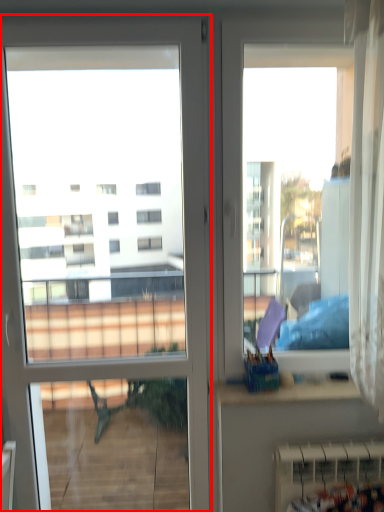
Question: From the image's perspective, what is the correct spatial positioning of door (annotated by the red box) in reference to radiator?

Choices:
 (A) below
 (B) above

Answer: (B)